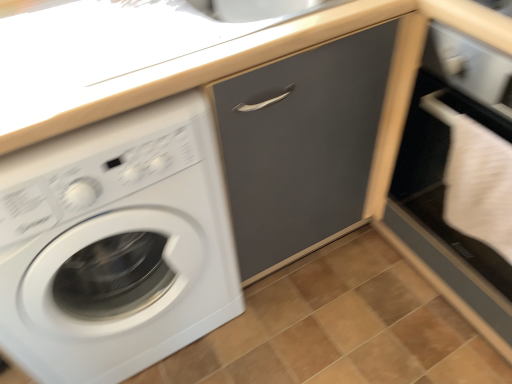
The width and height of the screenshot is (512, 384). What are the coordinates of `brown wooden tile at lower center` in the screenshot? It's located at (339, 327).

Describe the element at coordinates (301, 145) in the screenshot. The width and height of the screenshot is (512, 384). I see `matte gray drawer at center` at that location.

Locate an element on the screen. This screenshot has width=512, height=384. white matte file cabinet at lower right is located at coordinates (445, 187).

From the image's perspective, is white glossy washing machine at left above matte gray drawer at center?

Actually, white glossy washing machine at left appears below matte gray drawer at center in the image.

Considering the relative positions of white glossy washing machine at left and matte gray drawer at center in the image provided, is white glossy washing machine at left to the right of matte gray drawer at center from the viewer's perspective?

In fact, white glossy washing machine at left is to the left of matte gray drawer at center.

Is white glossy washing machine at left in contact with matte gray drawer at center?

No, white glossy washing machine at left is not beside matte gray drawer at center.

Does point (452, 260) appear closer or farther from the camera than point (407, 381)?

Clearly, point (452, 260) is closer to the camera than point (407, 381).

Is white matte file cabinet at lower right completely or partially outside of brown wooden tile at lower center?

Yes, white matte file cabinet at lower right is located beyond the bounds of brown wooden tile at lower center.

From the image's perspective, is white matte file cabinet at lower right positioned above or below brown wooden tile at lower center?

white matte file cabinet at lower right is situated higher than brown wooden tile at lower center in the image.

At what (x,y) coordinates should I click in order to perform the action: click on file cabinet on the right of brown wooden tile at lower center. Please return your answer as a coordinate pair (x, y). The width and height of the screenshot is (512, 384). Looking at the image, I should click on (445, 187).

How many degrees apart are the facing directions of white glossy washing machine at left and white matte file cabinet at lower right?

The angle between the facing direction of white glossy washing machine at left and the facing direction of white matte file cabinet at lower right is 90 degrees.

Relative to white matte file cabinet at lower right, is white glossy washing machine at left in front or behind?

In the image, white glossy washing machine at left appears in front of white matte file cabinet at lower right.

Which object is positioned more to the right, white glossy washing machine at left or white matte file cabinet at lower right?

white matte file cabinet at lower right.

I want to click on file cabinet located above the white glossy washing machine at left (from the image's perspective), so click(x=445, y=187).

Is matte gray drawer at center oriented towards white matte file cabinet at lower right?

No.

Looking at this image, does matte gray drawer at center appear on the right side of white matte file cabinet at lower right?

No.

Is matte gray drawer at center beside white matte file cabinet at lower right?

They are not placed beside each other.

Considering their positions, is matte gray drawer at center located in front of or behind white matte file cabinet at lower right?

Visually, matte gray drawer at center is located behind white matte file cabinet at lower right.

In terms of height, does brown wooden tile at lower center look taller or shorter compared to white matte file cabinet at lower right?

Clearly, brown wooden tile at lower center is shorter compared to white matte file cabinet at lower right.

Considering the sizes of objects brown wooden tile at lower center and white matte file cabinet at lower right in the image provided, who is thinner, brown wooden tile at lower center or white matte file cabinet at lower right?

With smaller width is white matte file cabinet at lower right.

Is point (434, 316) farther from camera compared to point (462, 79)?

Yes, point (434, 316) is behind point (462, 79).

Is matte gray drawer at center wider or thinner than brown wooden tile at lower center?

matte gray drawer at center is thinner than brown wooden tile at lower center.

Is matte gray drawer at center taller than brown wooden tile at lower center?

Indeed, matte gray drawer at center has a greater height compared to brown wooden tile at lower center.

From a real-world perspective, is matte gray drawer at center on top of brown wooden tile at lower center?

Indeed, from a real-world perspective, matte gray drawer at center stands above brown wooden tile at lower center.

Is brown wooden tile at lower center turned away from matte gray drawer at center?

Yes, brown wooden tile at lower center's orientation is away from matte gray drawer at center.

Consider the image. From a real-world perspective, which object rests below the other?

brown wooden tile at lower center.

Does brown wooden tile at lower center have a smaller size compared to matte gray drawer at center?

Correct, brown wooden tile at lower center occupies less space than matte gray drawer at center.

Identify the location of drawer on the right of white glossy washing machine at left. The image size is (512, 384). (301, 145).

This screenshot has height=384, width=512. In order to click on file cabinet that is above the brown wooden tile at lower center (from a real-world perspective) in this screenshot , I will do `click(445, 187)`.

Looking at the image, which one is located further to matte gray drawer at center, white glossy washing machine at left or brown wooden tile at lower center?

The object further to matte gray drawer at center is brown wooden tile at lower center.

Based on their spatial positions, is matte gray drawer at center or brown wooden tile at lower center further from white glossy washing machine at left?

Based on the image, brown wooden tile at lower center appears to be further to white glossy washing machine at left.

Based on their spatial positions, is white glossy washing machine at left or brown wooden tile at lower center closer to white matte file cabinet at lower right?

Based on the image, brown wooden tile at lower center appears to be nearer to white matte file cabinet at lower right.

When comparing their distances from white glossy washing machine at left, does white matte file cabinet at lower right or brown wooden tile at lower center seem further?

white matte file cabinet at lower right lies further to white glossy washing machine at left than the other object.

When comparing their distances from matte gray drawer at center, does brown wooden tile at lower center or white matte file cabinet at lower right seem further?

Among the two, brown wooden tile at lower center is located further to matte gray drawer at center.

Looking at the image, which one is located further to white matte file cabinet at lower right, brown wooden tile at lower center or white glossy washing machine at left?

white glossy washing machine at left lies further to white matte file cabinet at lower right than the other object.

When comparing their distances from white matte file cabinet at lower right, does matte gray drawer at center or brown wooden tile at lower center seem closer?

matte gray drawer at center.

Considering their positions, is matte gray drawer at center positioned further to brown wooden tile at lower center than white glossy washing machine at left?

Based on the image, matte gray drawer at center appears to be further to brown wooden tile at lower center.

This screenshot has height=384, width=512. I want to click on tile located between white glossy washing machine at left and white matte file cabinet at lower right in the left-right direction, so click(339, 327).

Identify the location of tile between matte gray drawer at center and white matte file cabinet at lower right in the horizontal direction. The width and height of the screenshot is (512, 384). (339, 327).

Find the location of a particular element. This screenshot has height=384, width=512. drawer located between white glossy washing machine at left and brown wooden tile at lower center in the left-right direction is located at coordinates [301, 145].

Locate an element on the screen. Image resolution: width=512 pixels, height=384 pixels. drawer between white glossy washing machine at left and white matte file cabinet at lower right is located at coordinates pyautogui.click(x=301, y=145).